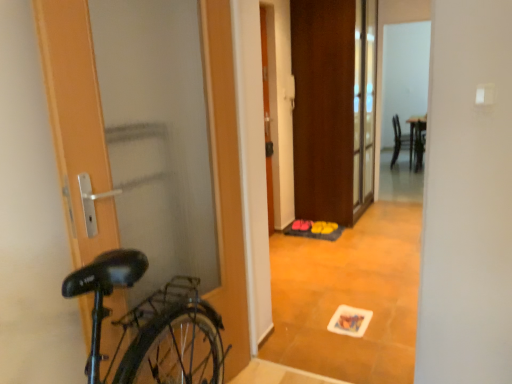
Question: Are brown matte door at center, acting as the 1th door starting from the back, and yellow rubber doormat at center far apart?

Choices:
 (A) yes
 (B) no

Answer: (B)

Question: Can you confirm if brown matte door at center, positioned as the first door in right-to-left order, is thinner than yellow rubber doormat at center?

Choices:
 (A) no
 (B) yes

Answer: (A)

Question: From the image's perspective, is brown matte door at center, placed as the 3th door when sorted from left to right, located beneath yellow rubber doormat at center?

Choices:
 (A) yes
 (B) no

Answer: (B)

Question: Is brown matte door at center, acting as the 1th door starting from the back, smaller than yellow rubber doormat at center?

Choices:
 (A) yes
 (B) no

Answer: (B)

Question: Does brown matte door at center, placed as the 3th door when sorted from left to right, lie behind yellow rubber doormat at center?

Choices:
 (A) yes
 (B) no

Answer: (B)

Question: From a real-world perspective, is brown matte door at center, placed as the 3th door when sorted from left to right, physically located above or below yellow rubber doormat at center?

Choices:
 (A) below
 (B) above

Answer: (B)

Question: Is brown matte door at center, arranged as the third door when viewed from the front, in front of or behind yellow rubber doormat at center in the image?

Choices:
 (A) front
 (B) behind

Answer: (A)

Question: In terms of width, does brown matte door at center, acting as the 1th door starting from the back, look wider or thinner when compared to yellow rubber doormat at center?

Choices:
 (A) thin
 (B) wide

Answer: (B)

Question: Is brown matte door at center, positioned as the first door in right-to-left order, taller or shorter than yellow rubber doormat at center?

Choices:
 (A) tall
 (B) short

Answer: (A)

Question: Would you say orange matte door at center, which is the second door in front-to-back order, is to the left or to the right of wooden door at left, the third door when ordered from back to front, in the picture?

Choices:
 (A) left
 (B) right

Answer: (B)

Question: Is orange matte door at center, the 2th door positioned from the back, bigger or smaller than wooden door at left, the third door when ordered from back to front?

Choices:
 (A) small
 (B) big

Answer: (A)

Question: From a real-world perspective, is orange matte door at center, the 2th door positioned from the back, above or below wooden door at left, the 1th door when ordered from left to right?

Choices:
 (A) below
 (B) above

Answer: (B)

Question: Looking at their shapes, would you say orange matte door at center, acting as the 2th door starting from the left, is wider or thinner than wooden door at left, the third door when ordered from back to front?

Choices:
 (A) thin
 (B) wide

Answer: (A)

Question: Considering the positions of point 394,117 and point 296,306, is point 394,117 closer or farther from the camera than point 296,306?

Choices:
 (A) farther
 (B) closer

Answer: (A)

Question: Visually, is matte black chair at upper right positioned to the left or to the right of wooden floor mat at center?

Choices:
 (A) left
 (B) right

Answer: (B)